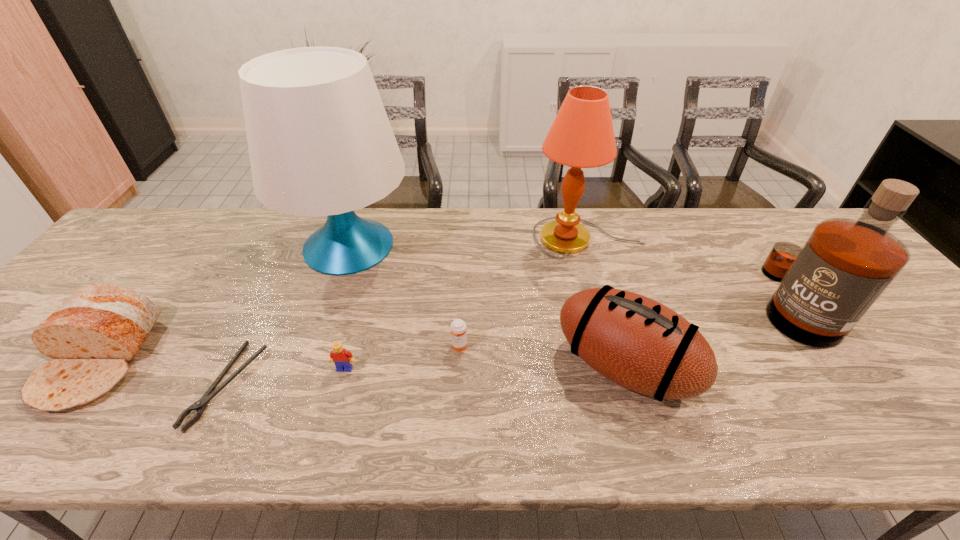
The image size is (960, 540). Find the location of `object that is the second closest to the fifth shortest object`. object that is the second closest to the fifth shortest object is located at coordinates (582, 136).

Image resolution: width=960 pixels, height=540 pixels. Identify the location of object identified as the third closest to the football (American). (827, 286).

What are the coordinates of `free space that satisfies the following two spatial constraints: 1. on the front label of the liquor; 2. at the sliced end of the bread` in the screenshot? It's located at (831, 360).

This screenshot has width=960, height=540. I want to click on free spot that satisfies the following two spatial constraints: 1. at the sliced end of the tongs; 2. on the left side of the leftmost object, so click(79, 384).